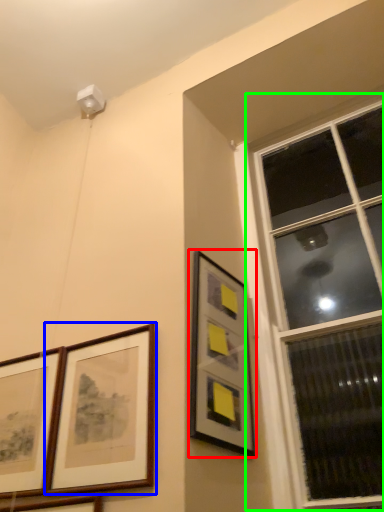
Question: Which object is the farthest from picture frame (highlighted by a red box)? Choose among these: picture frame (highlighted by a blue box) or window (highlighted by a green box).

Choices:
 (A) picture frame
 (B) window

Answer: (B)